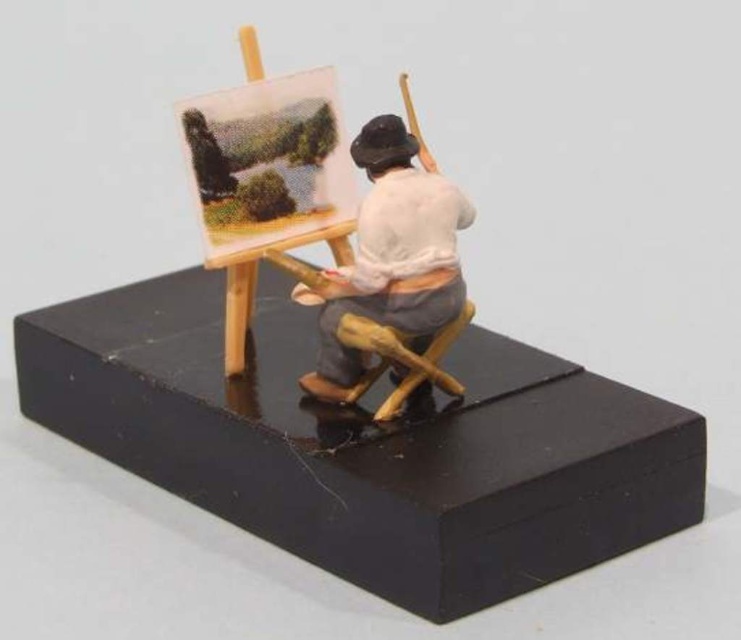
Is wooden easel at center taller than wooden figure at center?

Yes, wooden easel at center is taller than wooden figure at center.

Between point (247, 74) and point (385, 339), which one is positioned behind?

The point (247, 74) is behind.

I want to click on wooden easel at center, so click(x=265, y=177).